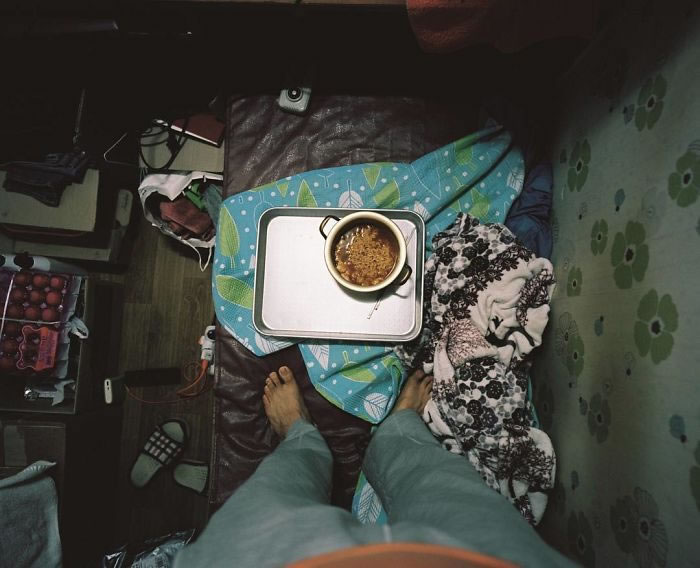
The height and width of the screenshot is (568, 700). Find the location of `christmas tree bulbs`. christmas tree bulbs is located at coordinates (26, 304).